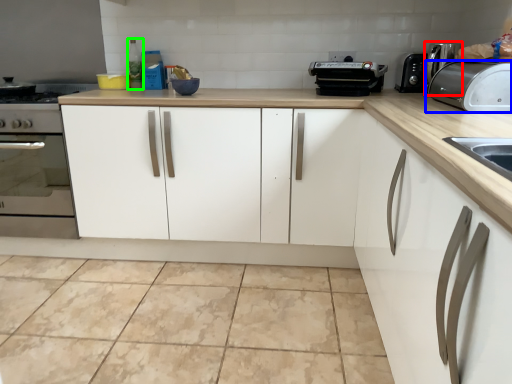
Question: Which is farther away from coffee machine (highlighted by a red box)? toaster (highlighted by a blue box) or bottle (highlighted by a green box)?

Choices:
 (A) toaster
 (B) bottle

Answer: (B)